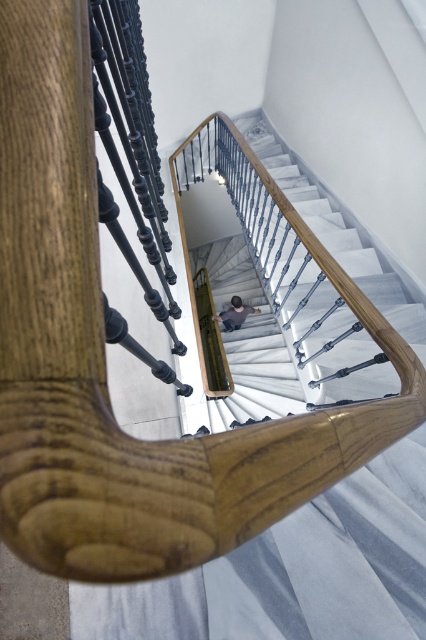
Question: Is white marble stairs at center positioned before dark gray shirt at center?

Choices:
 (A) no
 (B) yes

Answer: (B)

Question: Which point is farther to the camera?

Choices:
 (A) (268, 337)
 (B) (218, 317)

Answer: (B)

Question: Is white marble stairs at center bigger than dark gray shirt at center?

Choices:
 (A) no
 (B) yes

Answer: (B)

Question: Is white marble stairs at center thinner than dark gray shirt at center?

Choices:
 (A) yes
 (B) no

Answer: (B)